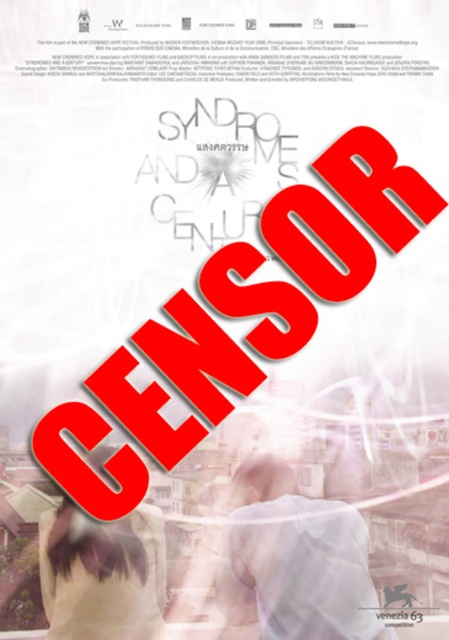
Looking at the promotional poster for the film, can you determine the spatial relationship between the white matte shirt at center and the light beige fabric at lower left?

The white matte shirt at center is positioned to the right of the light beige fabric at lower left.

Based on the scene described, which object, the white matte shirt at center or the light beige fabric at lower left, occupies a larger area in the image?

The white matte shirt at center is bigger than the light beige fabric at lower left, so it occupies a larger area in the image.